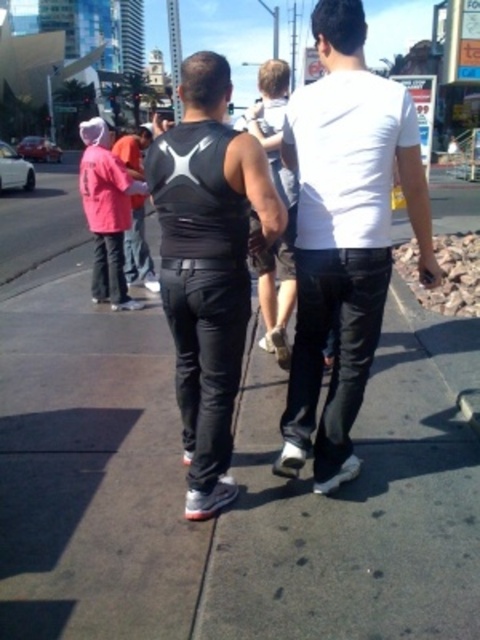
Question: Which of the following is the closest to the observer?

Choices:
 (A) (196, 170)
 (B) (296, 540)
 (C) (144, 257)
 (D) (101, 147)

Answer: (A)

Question: Where is gray concrete sidewalk at center located in relation to matte red shirt at center in the image?

Choices:
 (A) below
 (B) above

Answer: (A)

Question: Is gray concrete sidewalk at center bigger than black matte vest at center?

Choices:
 (A) no
 (B) yes

Answer: (A)

Question: Estimate the real-world distances between objects in this image. Which object is farther from the white matte shirt at center?

Choices:
 (A) black matte vest at center
 (B) matte red shirt at center

Answer: (B)

Question: In this image, where is black matte vest at center located relative to pink fabric shirt at left?

Choices:
 (A) above
 (B) below

Answer: (B)

Question: Which point is farther from the camera taking this photo?

Choices:
 (A) (26, 486)
 (B) (88, 221)
 (C) (139, 156)
 (D) (342, 184)

Answer: (B)